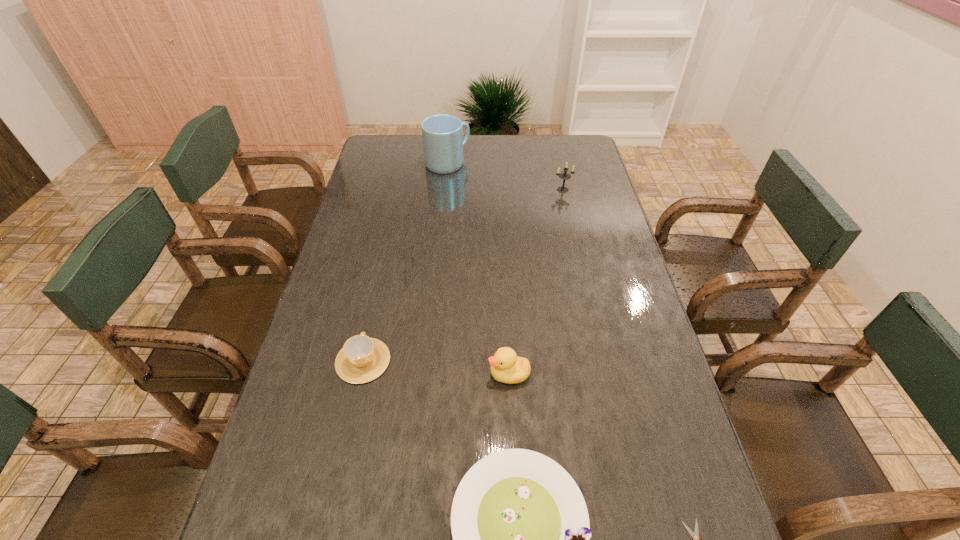
Find the location of a particular element. This screenshot has width=960, height=540. vacant region that satisfies the following two spatial constraints: 1. with the handle on the side of the candle holder; 2. on the left side of the third shortest object is located at coordinates (400, 190).